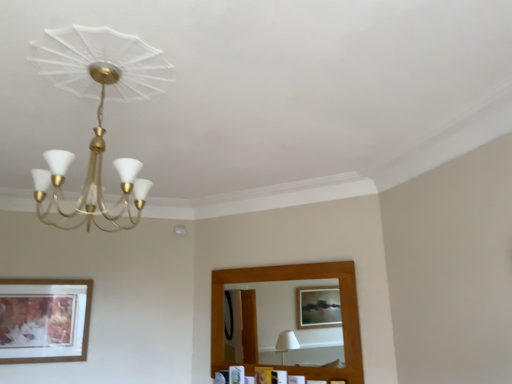
Question: Is wooden picture frame at lower left, the 3th picture frame from the right, outside wooden picture frame at lower center, acting as the third picture frame starting from the left?

Choices:
 (A) no
 (B) yes

Answer: (B)

Question: Does wooden picture frame at lower left, the 3th picture frame from the right, have a greater height compared to wooden picture frame at lower center, acting as the third picture frame starting from the left?

Choices:
 (A) yes
 (B) no

Answer: (A)

Question: Can you confirm if wooden picture frame at lower left, which is the 1th picture frame in left-to-right order, is thinner than wooden picture frame at lower center, acting as the third picture frame starting from the left?

Choices:
 (A) yes
 (B) no

Answer: (A)

Question: From the image's perspective, is wooden picture frame at lower left, which is the 1th picture frame in left-to-right order, under wooden picture frame at lower center, acting as the third picture frame starting from the left?

Choices:
 (A) no
 (B) yes

Answer: (A)

Question: From the image's perspective, is wooden picture frame at lower left, the 3th picture frame from the right, above wooden picture frame at lower center, acting as the third picture frame starting from the left?

Choices:
 (A) no
 (B) yes

Answer: (B)

Question: Is matte gold chandelier at upper left inside or outside of wooden picture frame at lower center, placed as the second picture frame when sorted from right to left?

Choices:
 (A) outside
 (B) inside

Answer: (A)

Question: From a real-world perspective, is matte gold chandelier at upper left positioned above or below wooden picture frame at lower center, positioned as the second picture frame in left-to-right order?

Choices:
 (A) below
 (B) above

Answer: (B)

Question: From the image's perspective, is matte gold chandelier at upper left located above or below wooden picture frame at lower center, positioned as the second picture frame in left-to-right order?

Choices:
 (A) above
 (B) below

Answer: (A)

Question: Is matte gold chandelier at upper left to the left or to the right of wooden picture frame at lower center, placed as the second picture frame when sorted from right to left, in the image?

Choices:
 (A) left
 (B) right

Answer: (A)

Question: Looking at their shapes, would you say wooden picture frame at lower left, the 3th picture frame from the right, is wider or thinner than matte gold chandelier at upper left?

Choices:
 (A) wide
 (B) thin

Answer: (B)

Question: Is wooden picture frame at lower left, the 3th picture frame from the right, bigger or smaller than matte gold chandelier at upper left?

Choices:
 (A) big
 (B) small

Answer: (B)

Question: From a real-world perspective, relative to matte gold chandelier at upper left, is wooden picture frame at lower left, the 3th picture frame from the right, vertically above or below?

Choices:
 (A) below
 (B) above

Answer: (A)

Question: From the image's perspective, relative to matte gold chandelier at upper left, is wooden picture frame at lower left, which is the 1th picture frame in left-to-right order, above or below?

Choices:
 (A) below
 (B) above

Answer: (A)

Question: Does point [x=232, y=382] appear closer or farther from the camera than point [x=36, y=46]?

Choices:
 (A) farther
 (B) closer

Answer: (A)

Question: Would you say wooden picture frame at lower center, positioned as the second picture frame in left-to-right order, is inside or outside matte gold chandelier at upper left?

Choices:
 (A) inside
 (B) outside

Answer: (B)